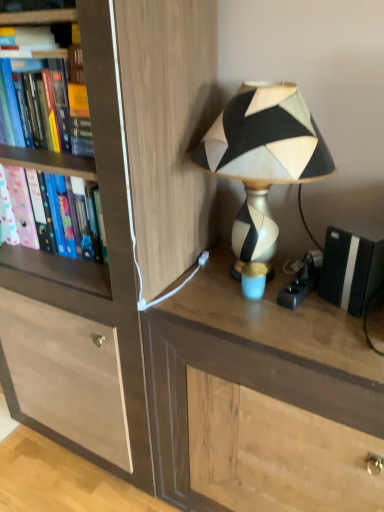
The height and width of the screenshot is (512, 384). I want to click on vacant region below black and white geometric lampshade at upper right (from a real-world perspective), so click(244, 282).